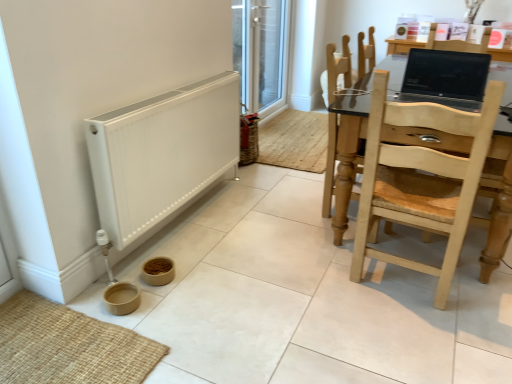
The image size is (512, 384). In order to click on free space in front of light brown wooden chair at right, which appears as the 1th chair when viewed from the back in this screenshot , I will do `click(354, 236)`.